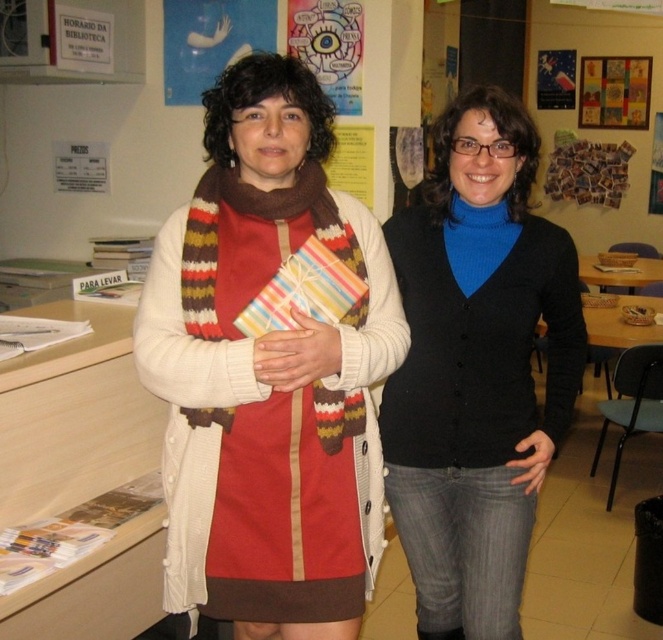
Question: Where is brown striped scarf at center located in relation to colorful paper poster at upper center in the image?

Choices:
 (A) above
 (B) below

Answer: (B)

Question: Can you confirm if brown striped scarf at center is smaller than white paper at upper left?

Choices:
 (A) yes
 (B) no

Answer: (B)

Question: Which point is farther to the camera?

Choices:
 (A) pos(249,422)
 (B) pos(416,404)
 (C) pos(322,417)

Answer: (B)

Question: Estimate the real-world distances between objects in this image. Which object is farther from the metallic poster at upper center?

Choices:
 (A) white paper at upper left
 (B) matte paper poster at upper center
 (C) brown striped scarf at center
 (D) white knitted scarf at center

Answer: (D)

Question: Which point is farther to the camera?

Choices:
 (A) (288, 36)
 (B) (434, 611)
 (C) (613, 120)
 (D) (206, 42)

Answer: (C)

Question: Does white knitted scarf at center have a larger size compared to black matte cardigan at center?

Choices:
 (A) no
 (B) yes

Answer: (B)